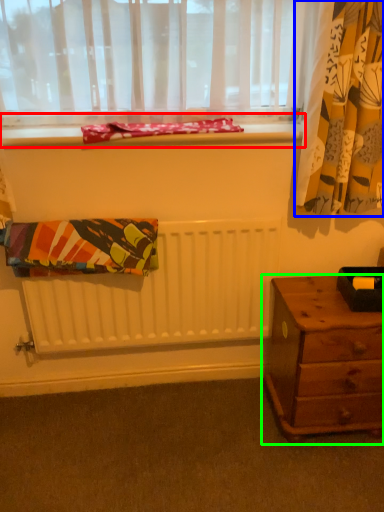
Question: Which object is positioned farthest from window sill (highlighted by a red box)? Select from curtain (highlighted by a blue box) and nightstand (highlighted by a green box).

Choices:
 (A) curtain
 (B) nightstand

Answer: (B)